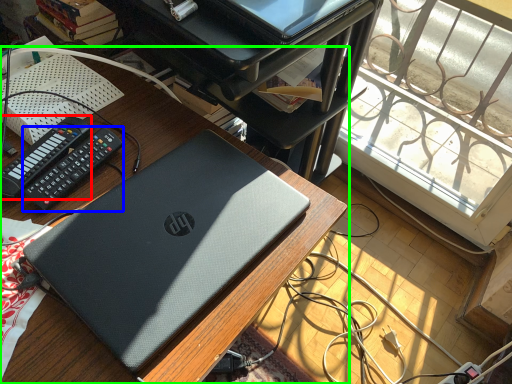
Question: Estimate the real-world distances between objects in this image. Which object is closer to control (highlighted by a red box), control (highlighted by a blue box) or desk (highlighted by a green box)?

Choices:
 (A) control
 (B) desk

Answer: (A)